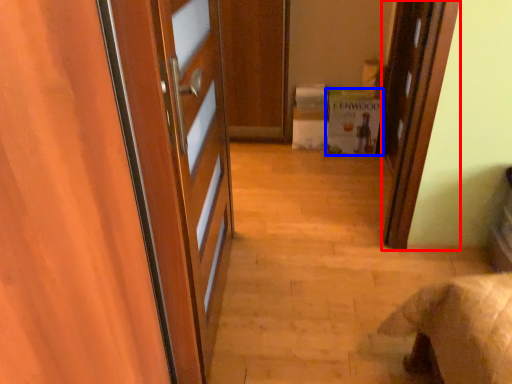
Question: Which of the following is the farthest to the observer, door (highlighted by a red box) or cabinetry (highlighted by a blue box)?

Choices:
 (A) door
 (B) cabinetry

Answer: (B)